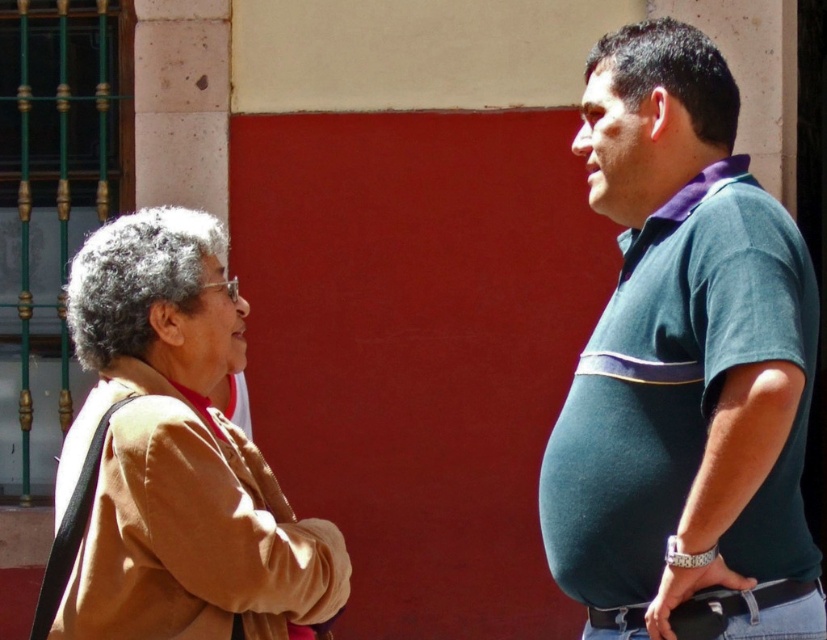
Question: Which object appears farthest from the camera in this image?

Choices:
 (A) green cotton shirt at right
 (B) light brown fabric jacket at left

Answer: (A)

Question: Which of the following is the closest to the observer?

Choices:
 (A) (161, 304)
 (B) (653, 168)

Answer: (A)

Question: Is green cotton shirt at right to the right of light brown fabric jacket at left from the viewer's perspective?

Choices:
 (A) yes
 (B) no

Answer: (A)

Question: Is green cotton shirt at right above light brown fabric jacket at left?

Choices:
 (A) no
 (B) yes

Answer: (B)

Question: Does green cotton shirt at right have a lesser width compared to light brown fabric jacket at left?

Choices:
 (A) no
 (B) yes

Answer: (B)

Question: Which object is farther from the camera taking this photo?

Choices:
 (A) light brown fabric jacket at left
 (B) green cotton shirt at right

Answer: (B)